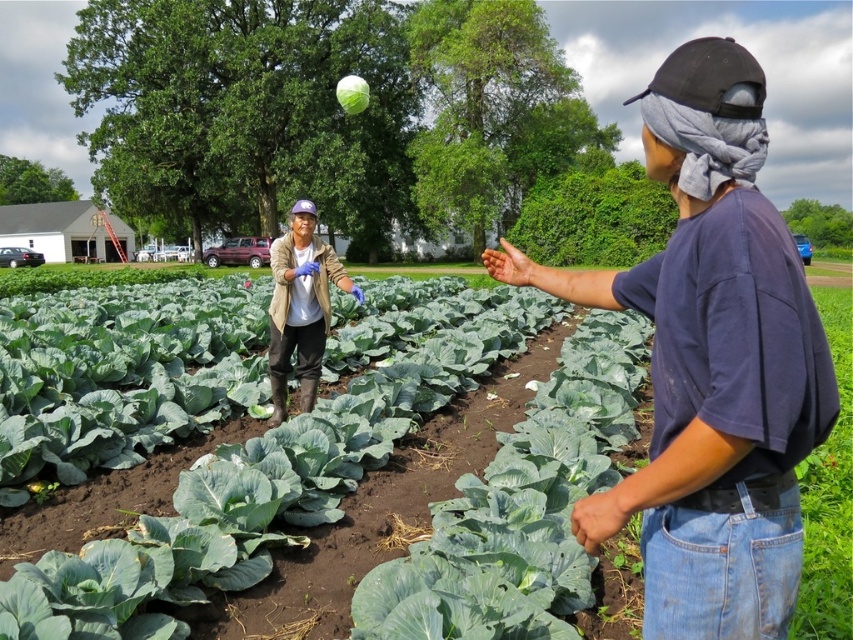
Which of these two, green leafy vegetables at center or matte beige jacket at center, stands taller?

With more height is green leafy vegetables at center.

Does green leafy vegetables at center come behind matte beige jacket at center?

No, it is in front of matte beige jacket at center.

Is point (277, 509) farther from camera compared to point (283, 396)?

No, it is not.

Identify the location of green leafy vegetables at center. The image size is (853, 640). (277, 470).

Is point (669, 282) positioned in front of point (450, 564)?

Yes, it is in front of point (450, 564).

Looking at this image, is dark blue t-shirt at center to the right of green leafy cabbage at center from the viewer's perspective?

Correct, you'll find dark blue t-shirt at center to the right of green leafy cabbage at center.

At what (x,y) coordinates should I click in order to perform the action: click on dark blue t-shirt at center. Please return your answer as a coordinate pair (x, y). The width and height of the screenshot is (853, 640). Looking at the image, I should click on (711, 362).

Between point (718, 362) and point (320, 333), which one is positioned in front?

Positioned in front is point (718, 362).

Can you confirm if dark blue t-shirt at center is positioned below matte beige jacket at center?

Yes.

This screenshot has height=640, width=853. Find the location of `dark blue t-shirt at center`. dark blue t-shirt at center is located at coordinates (711, 362).